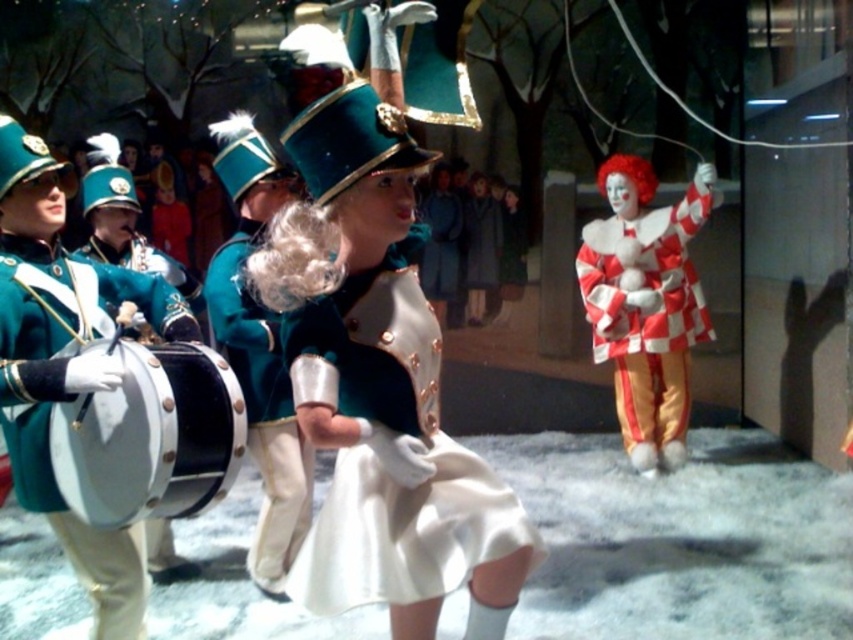
Is point (27, 483) positioned in front of point (277, 452)?

That is True.

The image size is (853, 640). I want to click on green fabric drum at left, so click(73, 397).

Who is taller, checkered fabric clown at right or green matte uniform at center?

checkered fabric clown at right

Can you confirm if checkered fabric clown at right is positioned above green matte uniform at center?

Yes, checkered fabric clown at right is above green matte uniform at center.

Is point (601, 224) positioned before point (247, 365)?

No, it is not.

At what (x,y) coordinates should I click in order to perform the action: click on checkered fabric clown at right. Please return your answer as a coordinate pair (x, y). This screenshot has height=640, width=853. Looking at the image, I should click on (646, 305).

Between green fabric drum at left and checkered fabric clown at right, which one appears on the right side from the viewer's perspective?

Positioned to the right is checkered fabric clown at right.

Is green fabric drum at left thinner than checkered fabric clown at right?

Yes, green fabric drum at left is thinner than checkered fabric clown at right.

Who is more forward, (97, 630) or (701, 323)?

Point (97, 630) is more forward.

Identify the location of green fabric drum at left. The height and width of the screenshot is (640, 853). (73, 397).